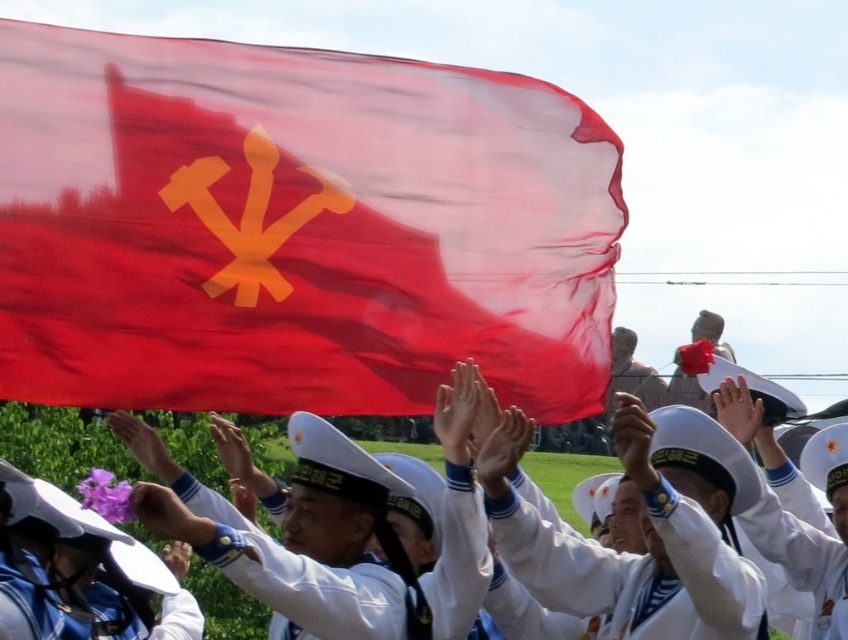
Based on the scene description, can you determine which object, the red fabric flag at upper center or the white cotton sailor hat at upper center, is taller?

The red fabric flag at upper center is taller than the white cotton sailor hat at upper center according to the description.

You are a photographer standing at the edge of the scene. You need to take a photo of both the white matte sailor uniform at center and the white matte uniform at center. The minimum distance between them in the photo should be 15 feet. Can you capture them both in the same frame without moving either uniform?

The distance between the white matte sailor uniform at center and the white matte uniform at center is 17.33 feet, which exceeds the required 15 feet. Therefore, you can capture both in the same frame without moving them.